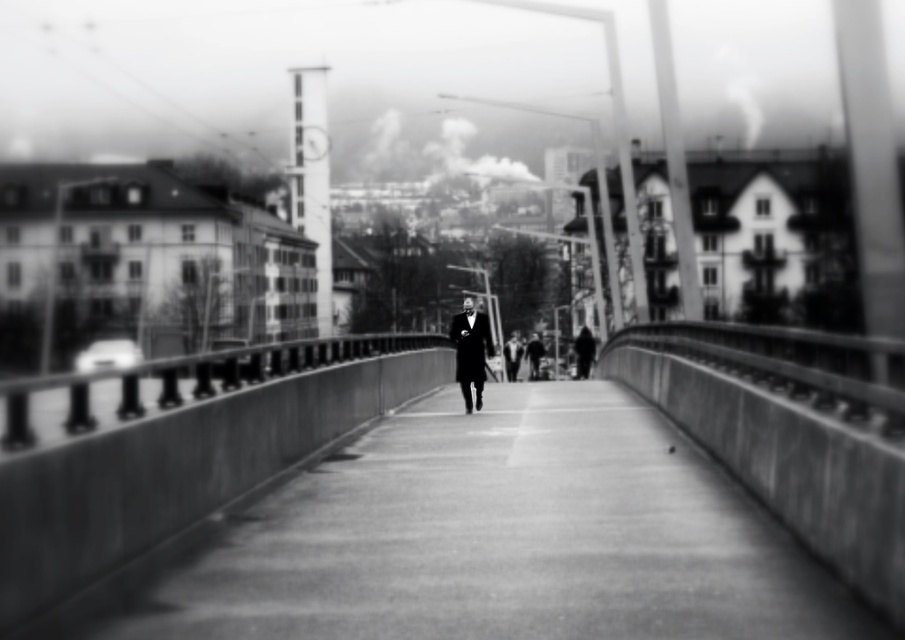
Based on the photo, you are standing at the bridge in the image and want to walk towards the point that is closer to you. Which point should you head towards, point (x=388, y=563) or point (x=489, y=348)?

You should head towards point (x=388, y=563) because it is closer to the viewer than point (x=489, y=348) according to the description.